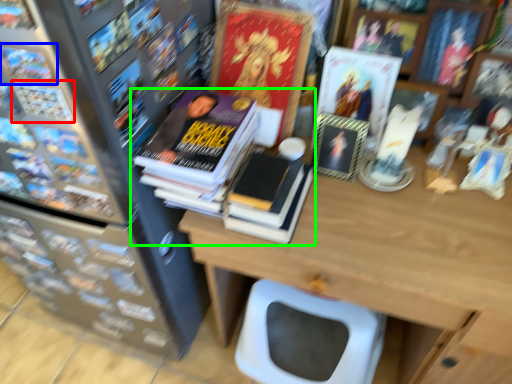
Question: Which is nearer to the book (highlighted by a red box)? book (highlighted by a blue box) or book (highlighted by a green box).

Choices:
 (A) book
 (B) book

Answer: (A)